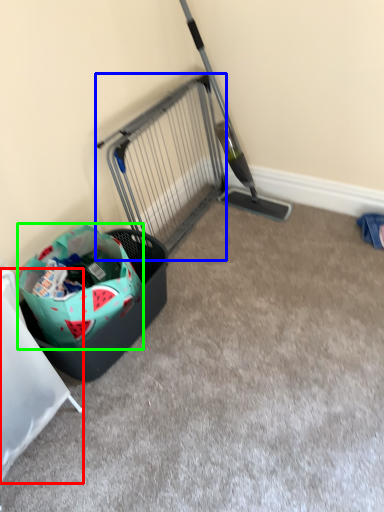
Question: Considering the real-world distances, which object is farthest from furniture (highlighted by a red box)? cage (highlighted by a blue box) or shopping bag (highlighted by a green box)?

Choices:
 (A) cage
 (B) shopping bag

Answer: (A)